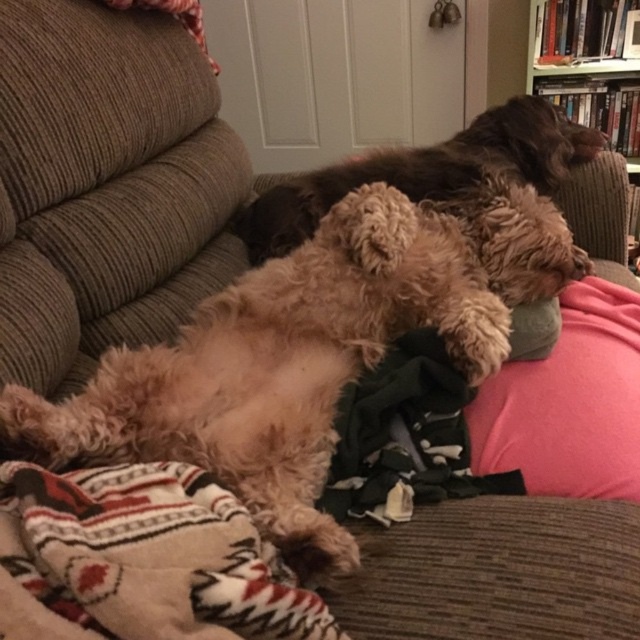
Question: Is knitted wool blanket at lower left bigger than fuzzy brown dog at center?

Choices:
 (A) no
 (B) yes

Answer: (A)

Question: Which point is closer to the camera?

Choices:
 (A) wooden bookshelf at upper right
 (B) fuzzy brown dog at center
 (C) pink fabric pillow at center

Answer: (C)

Question: Which point is farther to the camera?

Choices:
 (A) knitted wool blanket at lower left
 (B) fuzzy brown dog at center

Answer: (B)

Question: Does pink fabric pillow at center appear over wooden bookshelf at upper right?

Choices:
 (A) no
 (B) yes

Answer: (A)

Question: Is pink fabric pillow at center further to the viewer compared to wooden bookshelf at upper right?

Choices:
 (A) yes
 (B) no

Answer: (B)

Question: Which point appears closest to the camera in this image?

Choices:
 (A) (150, 518)
 (B) (602, 22)
 (C) (579, 304)

Answer: (A)